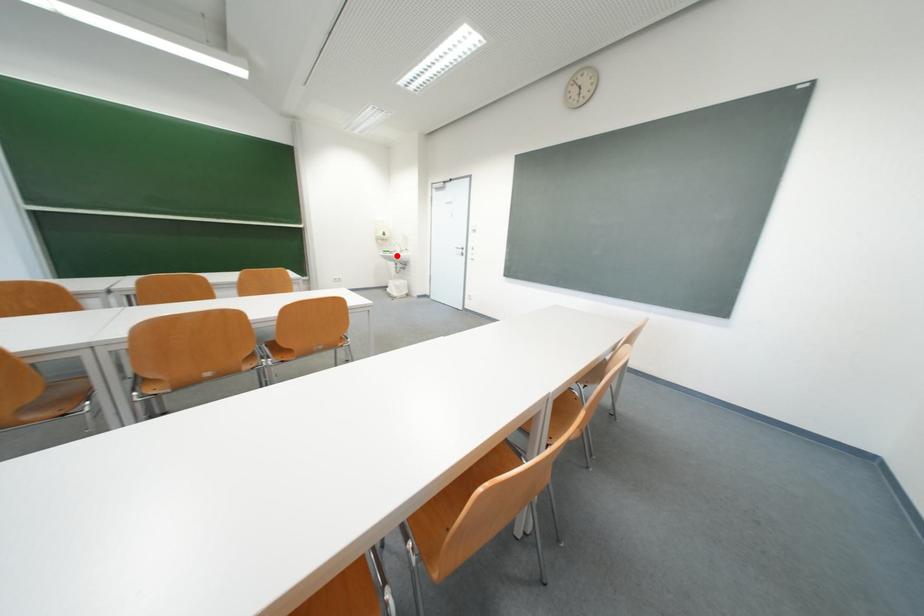
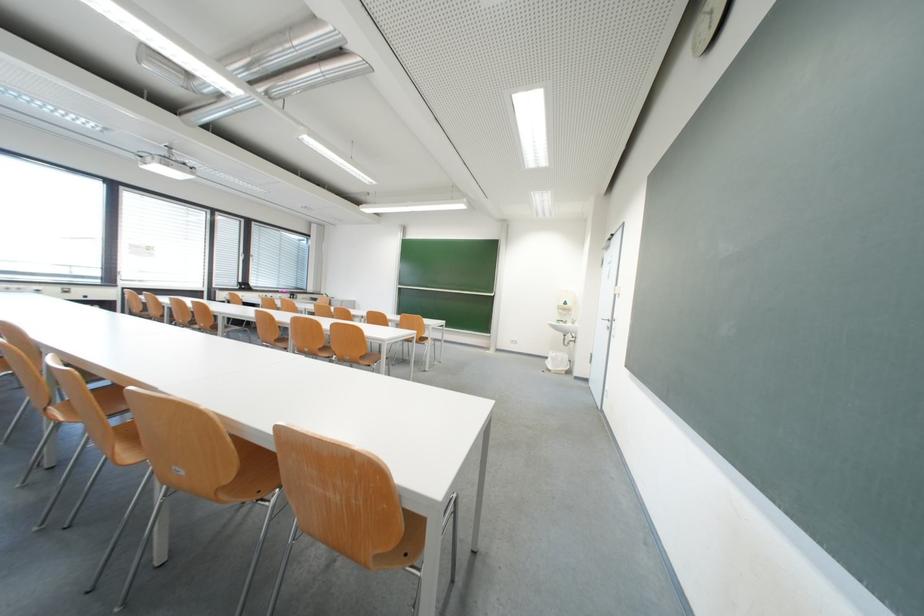
Locate, in the second image, the point that corresponds to the highlighted location in the first image.

(570, 326)